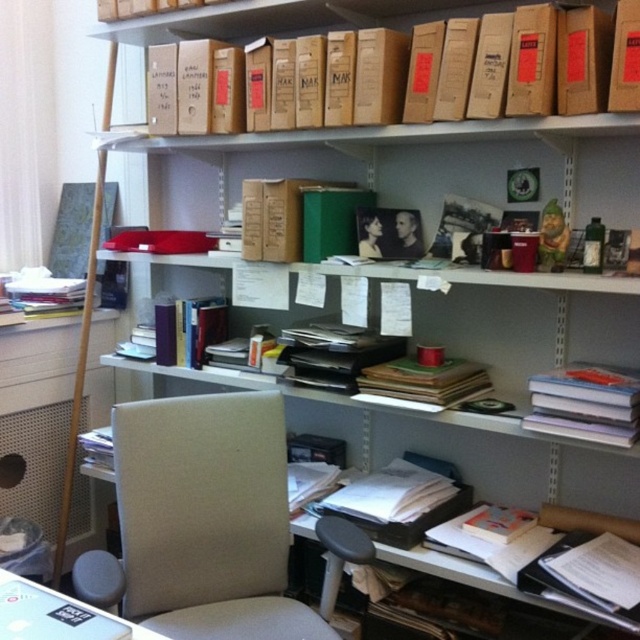
Question: Can you confirm if beige fabric swivel chair at center is smaller than white paper stack at center-right?

Choices:
 (A) yes
 (B) no

Answer: (B)

Question: Is beige fabric swivel chair at center further to camera compared to white paper stack at center-right?

Choices:
 (A) yes
 (B) no

Answer: (B)

Question: Which object is positioned closest to the hardcover book at center?

Choices:
 (A) beige fabric swivel chair at center
 (B) white paper stack at center-right

Answer: (B)

Question: Does white paper stack at center-right have a lesser width compared to hardcover book at center?

Choices:
 (A) yes
 (B) no

Answer: (A)

Question: Which is farther from the beige fabric swivel chair at center?

Choices:
 (A) hardcover book at center
 (B) white paper stack at center-right

Answer: (B)

Question: Which of these objects is positioned farthest from the hardcover book at center?

Choices:
 (A) beige fabric swivel chair at center
 (B) white paper stack at center-right

Answer: (A)